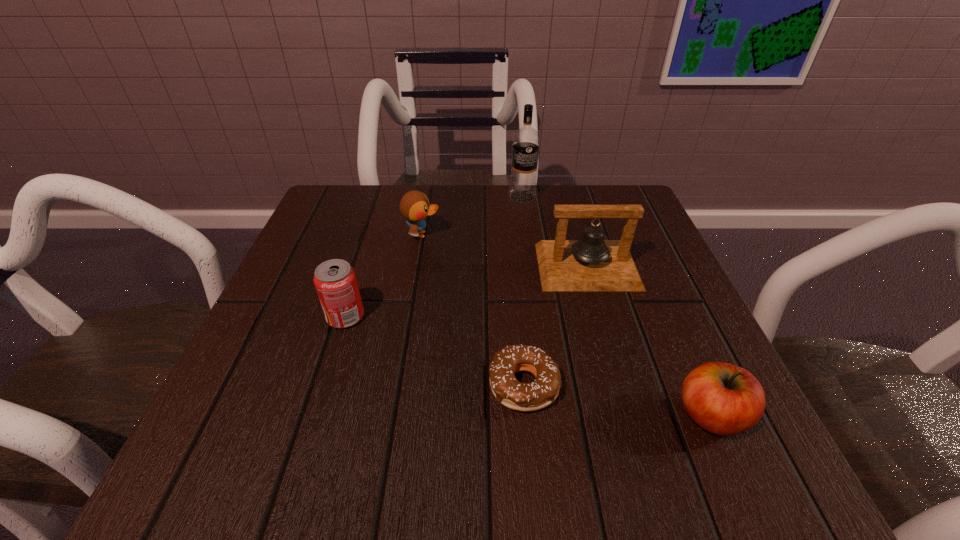
Find the location of `object at the left edge`. object at the left edge is located at coordinates (335, 280).

The height and width of the screenshot is (540, 960). In order to click on bell positioned at the right edge in this screenshot , I will do `click(591, 263)`.

You are a GUI agent. You are given a task and a screenshot of the screen. Output one action in this format:
    pyautogui.click(x=<x>, y=<y>)
    Task: Click on the apple present at the right edge
    This screenshot has width=960, height=540.
    Given the screenshot: What is the action you would take?
    (724, 399)

You are a GUI agent. You are given a task and a screenshot of the screen. Output one action in this format:
    pyautogui.click(x=<x>, y=<y>)
    Task: Click on the object at the far right corner
    This screenshot has height=540, width=960.
    Given the screenshot: What is the action you would take?
    pyautogui.click(x=591, y=263)

Image resolution: width=960 pixels, height=540 pixels. In order to click on object situated at the near right corner in this screenshot , I will do `click(724, 399)`.

Where is `free space at the far edge of the desktop`? Image resolution: width=960 pixels, height=540 pixels. free space at the far edge of the desktop is located at coordinates (466, 216).

Where is `vacant space at the near edge`? The image size is (960, 540). vacant space at the near edge is located at coordinates (503, 426).

This screenshot has width=960, height=540. I want to click on vacant area at the left edge of the desktop, so pos(371,260).

Find the location of a particular element. This screenshot has height=540, width=960. free space at the right edge of the desktop is located at coordinates (695, 325).

Where is `free space at the far left corner`? This screenshot has height=540, width=960. free space at the far left corner is located at coordinates (341, 198).